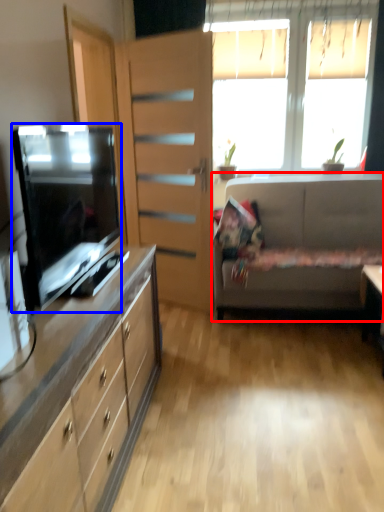
Question: Which object appears farthest to the camera in this image, studio couch (highlighted by a red box) or television (highlighted by a blue box)?

Choices:
 (A) studio couch
 (B) television

Answer: (A)